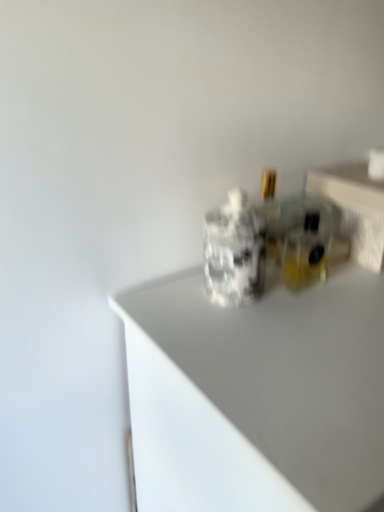
What do you see at coordinates (256, 395) in the screenshot? The width and height of the screenshot is (384, 512). I see `white glossy countertop at center` at bounding box center [256, 395].

Where is `white glossy countertop at center`? white glossy countertop at center is located at coordinates (256, 395).

Where is `transparent glass perfume bottles at upper right`? transparent glass perfume bottles at upper right is located at coordinates (354, 208).

The image size is (384, 512). Describe the element at coordinates (354, 208) in the screenshot. I see `transparent glass perfume bottles at upper right` at that location.

The height and width of the screenshot is (512, 384). In order to click on white glossy countertop at center in this screenshot , I will do `click(256, 395)`.

Which is more to the right, transparent glass perfume bottles at upper right or white glossy countertop at center?

transparent glass perfume bottles at upper right is more to the right.

In the image, is transparent glass perfume bottles at upper right positioned in front of or behind white glossy countertop at center?

transparent glass perfume bottles at upper right is behind white glossy countertop at center.

Which is behind, point (361, 223) or point (213, 322)?

The point (361, 223) is farther.

From the image's perspective, which one is positioned lower, transparent glass perfume bottles at upper right or white glossy countertop at center?

Answer: white glossy countertop at center, from the image's perspective.

In the scene shown: From a real-world perspective, between transparent glass perfume bottles at upper right and white glossy countertop at center, who is vertically higher?

From a 3D spatial view, transparent glass perfume bottles at upper right is above.

Is transparent glass perfume bottles at upper right thinner than white glossy countertop at center?

Indeed, transparent glass perfume bottles at upper right has a lesser width compared to white glossy countertop at center.

Is transparent glass perfume bottles at upper right taller than white glossy countertop at center?

Incorrect, the height of transparent glass perfume bottles at upper right is not larger of that of white glossy countertop at center.

Is transparent glass perfume bottles at upper right bigger or smaller than white glossy countertop at center?

In the image, transparent glass perfume bottles at upper right appears to be smaller than white glossy countertop at center.

Is transparent glass perfume bottles at upper right spatially inside white glossy countertop at center, or outside of it?

transparent glass perfume bottles at upper right is spatially situated outside white glossy countertop at center.

Would you say transparent glass perfume bottles at upper right is a long distance from white glossy countertop at center?

Actually, transparent glass perfume bottles at upper right and white glossy countertop at center are a little close together.

Is transparent glass perfume bottles at upper right oriented towards white glossy countertop at center?

No, transparent glass perfume bottles at upper right does not turn towards white glossy countertop at center.

Looking at this image, what's the angular difference between transparent glass perfume bottles at upper right and white glossy countertop at center's facing directions?

There is a 0.895-degree angle between the facing directions of transparent glass perfume bottles at upper right and white glossy countertop at center.

Could you measure the distance between transparent glass perfume bottles at upper right and white glossy countertop at center?

10.89 inches.

Where is `countertop on the left of the transparent glass perfume bottles at upper right`? This screenshot has height=512, width=384. countertop on the left of the transparent glass perfume bottles at upper right is located at coordinates (256, 395).

Looking at this image, which is more to the left, white glossy countertop at center or transparent glass perfume bottles at upper right?

From the viewer's perspective, white glossy countertop at center appears more on the left side.

In the scene shown: In the image, is white glossy countertop at center positioned in front of or behind transparent glass perfume bottles at upper right?

In the image, white glossy countertop at center appears in front of transparent glass perfume bottles at upper right.

Is point (145, 300) closer or farther from the camera than point (307, 189)?

Point (145, 300) appears to be closer to the viewer than point (307, 189).

From the image's perspective, which one is positioned lower, white glossy countertop at center or transparent glass perfume bottles at upper right?

From the image's view, white glossy countertop at center is below.

Based on the photo, from a real-world perspective, is white glossy countertop at center beneath transparent glass perfume bottles at upper right?

Indeed, from a real-world perspective, white glossy countertop at center is positioned beneath transparent glass perfume bottles at upper right.

Looking at their sizes, would you say white glossy countertop at center is wider or thinner than transparent glass perfume bottles at upper right?

Clearly, white glossy countertop at center has more width compared to transparent glass perfume bottles at upper right.

In the scene shown: Who is shorter, white glossy countertop at center or transparent glass perfume bottles at upper right?

Standing shorter between the two is transparent glass perfume bottles at upper right.

In terms of size, does white glossy countertop at center appear bigger or smaller than transparent glass perfume bottles at upper right?

white glossy countertop at center is bigger than transparent glass perfume bottles at upper right.

Is transparent glass perfume bottles at upper right surrounded by white glossy countertop at center?

That's incorrect, transparent glass perfume bottles at upper right is not inside white glossy countertop at center.

Would you consider white glossy countertop at center to be distant from transparent glass perfume bottles at upper right?

No, white glossy countertop at center is not far away from transparent glass perfume bottles at upper right.

Is white glossy countertop at center aimed at transparent glass perfume bottles at upper right?

No, white glossy countertop at center is not turned towards transparent glass perfume bottles at upper right.

How distant is white glossy countertop at center from transparent glass perfume bottles at upper right?

10.89 inches.

Where is `countertop that is in front of the transparent glass perfume bottles at upper right`? countertop that is in front of the transparent glass perfume bottles at upper right is located at coordinates (256, 395).

You are a GUI agent. You are given a task and a screenshot of the screen. Output one action in this format:
    pyautogui.click(x=<x>, y=<y>)
    Task: Click on the table behind the white glossy countertop at center
    The width and height of the screenshot is (384, 512).
    Given the screenshot: What is the action you would take?
    pyautogui.click(x=354, y=208)

At what (x,y) coordinates should I click in order to perform the action: click on countertop to the left of transparent glass perfume bottles at upper right. Please return your answer as a coordinate pair (x, y). This screenshot has width=384, height=512. Looking at the image, I should click on (256, 395).